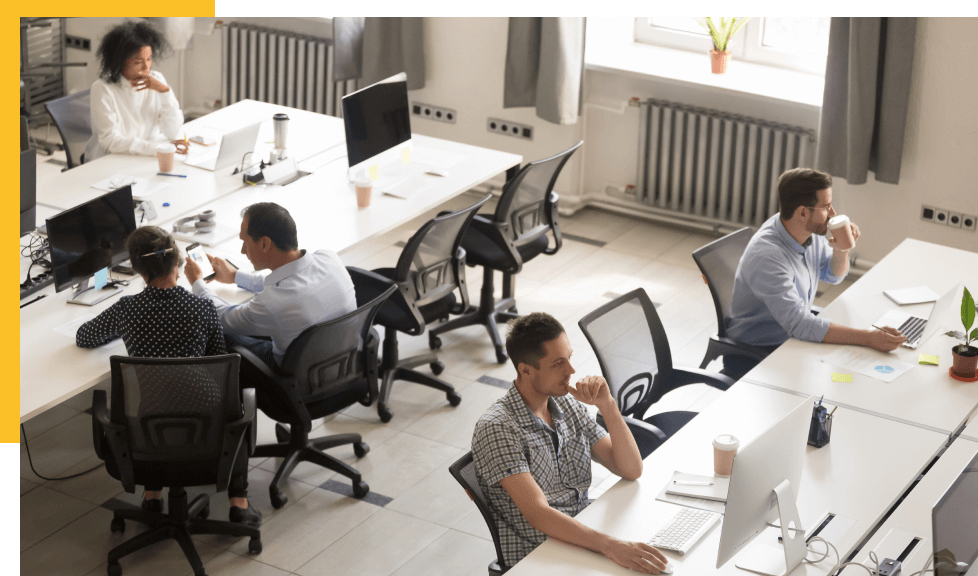
Locate an element on the screen. This screenshot has width=978, height=576. people sitting in chair is located at coordinates (144, 324), (289, 308), (548, 445), (778, 263), (137, 85).